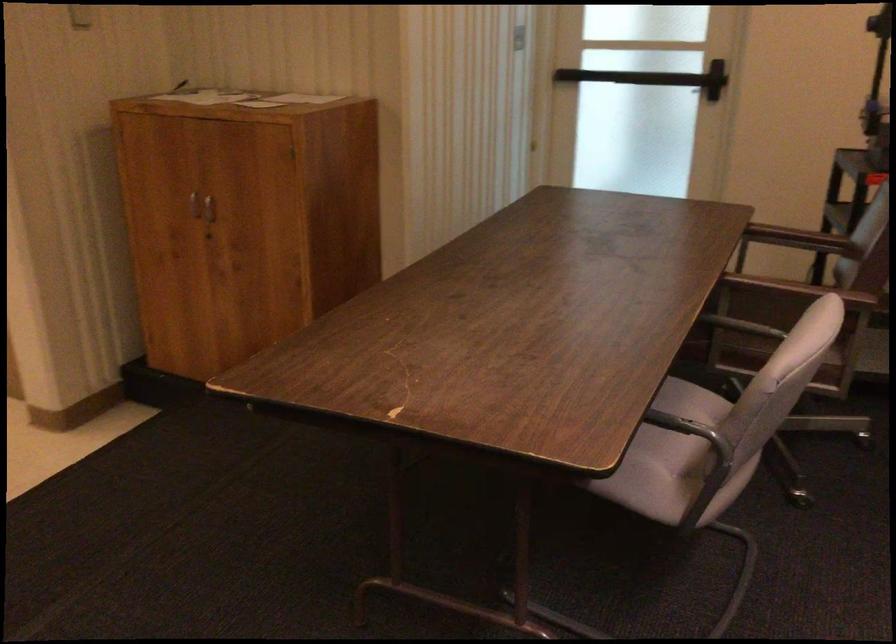
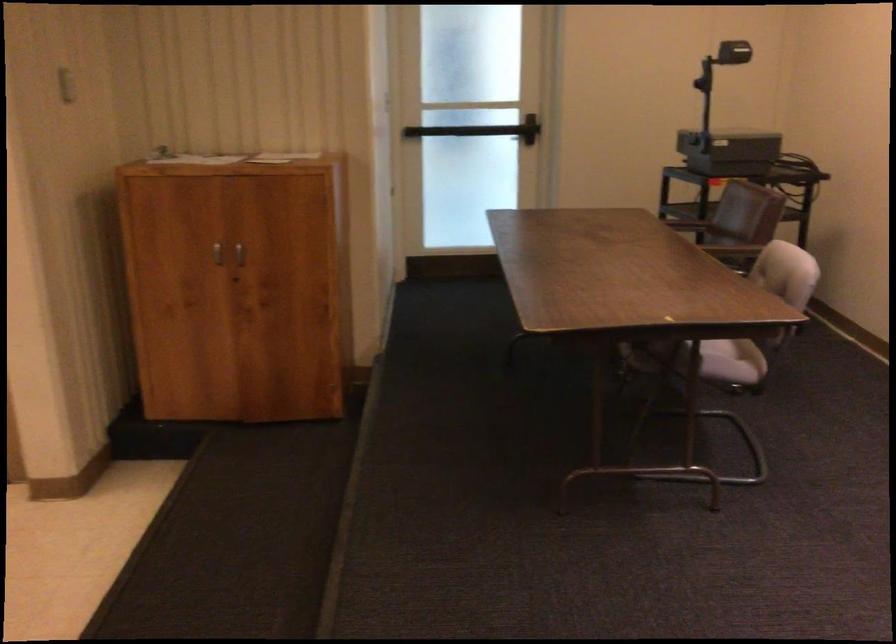
The point at [252,96] is marked in the first image. Where is the corresponding point in the second image?

(227, 158)